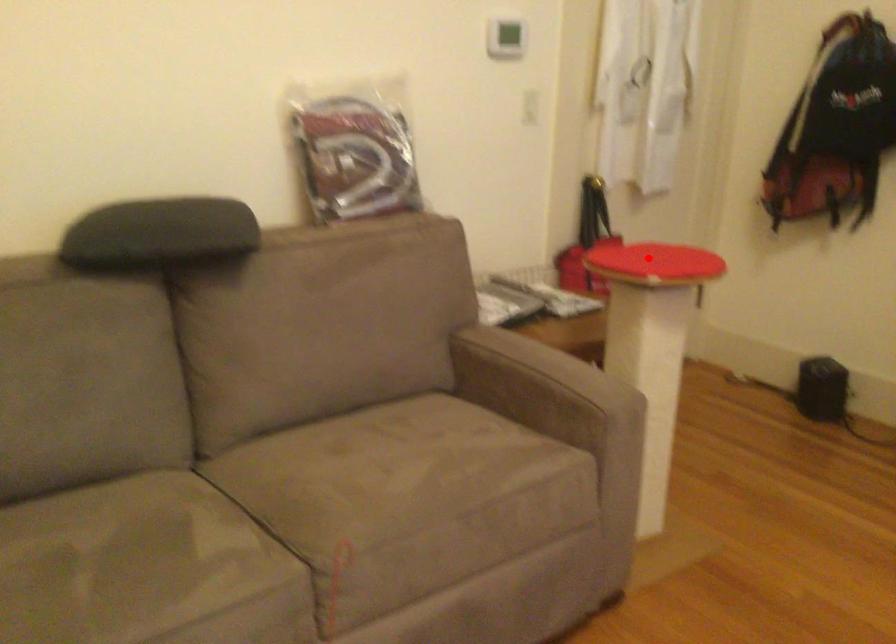
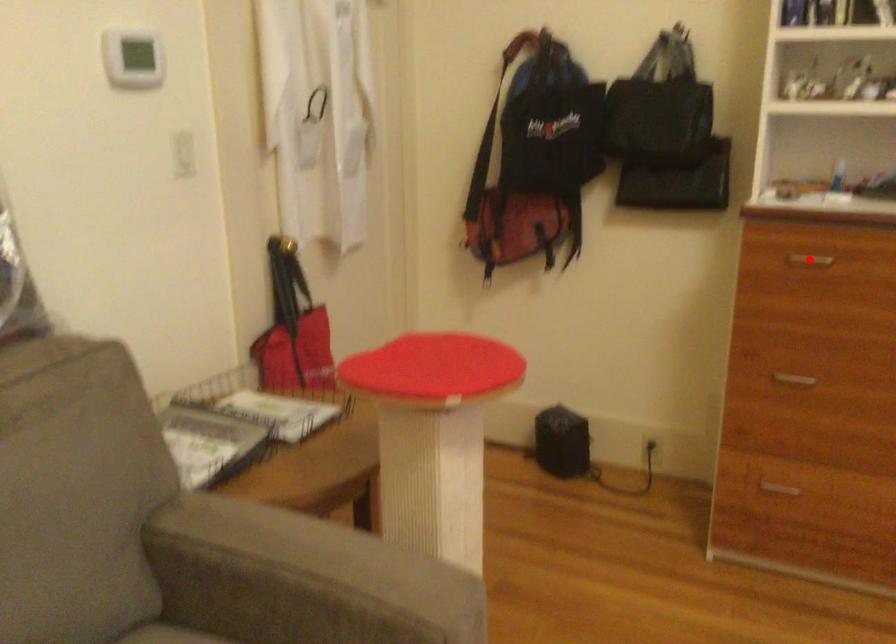
I am providing you with two images of the same scene from different viewpoints. A red point is marked on the first image and another point is marked on the second image. Is the marked point in image1 the same physical position as the marked point in image2?

No